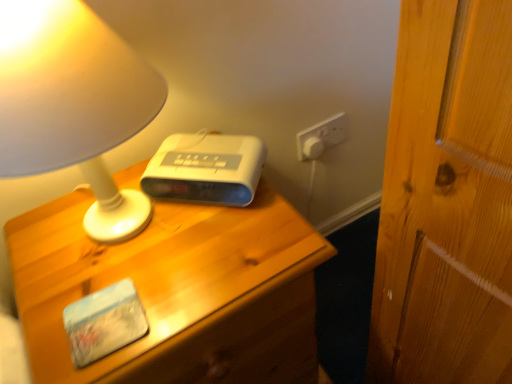
Find the location of a particular element. This screenshot has width=512, height=384. vacant region under matte white lamp at upper left (from a real-world perspective) is located at coordinates (116, 239).